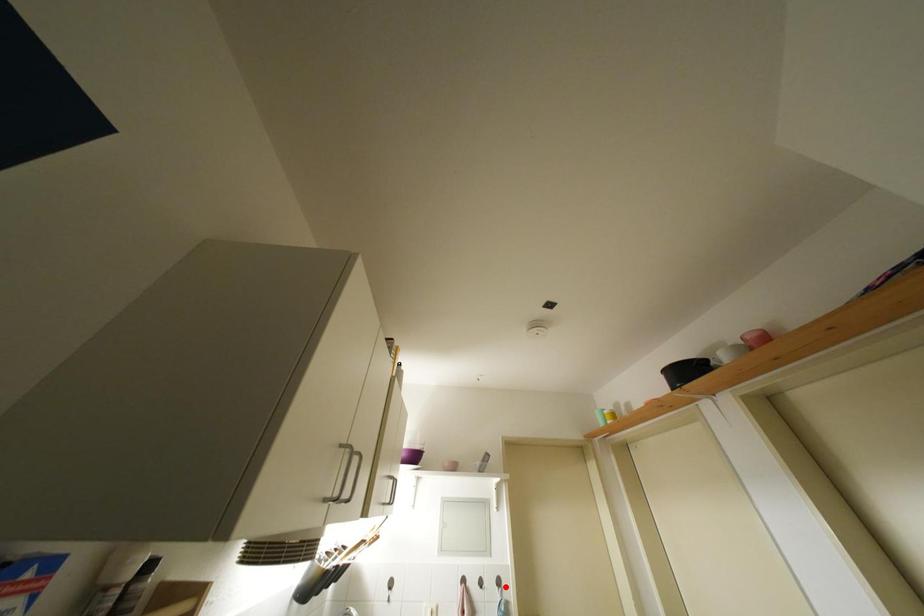
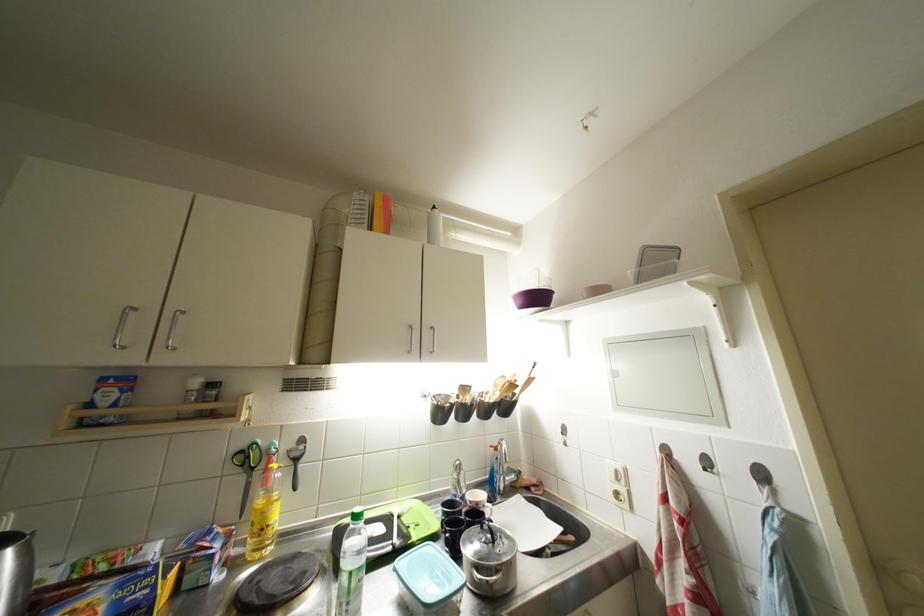
The point at the highlighted location is marked in the first image. Where is the corresponding point in the second image?

(769, 479)